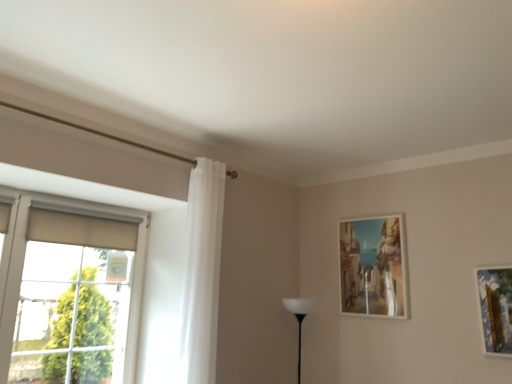
You are a GUI agent. You are given a task and a screenshot of the screen. Output one action in this format:
    pyautogui.click(x=<x>, y=<y>)
    Task: Click on the matte wooden picture frame at upper right
    Image resolution: width=512 pixels, height=384 pixels.
    Given the screenshot: What is the action you would take?
    (373, 267)

This screenshot has width=512, height=384. What do you see at coordinates (298, 319) in the screenshot?
I see `white matte table lamp at center` at bounding box center [298, 319].

The image size is (512, 384). What do you see at coordinates (202, 271) in the screenshot?
I see `white sheer curtain at left` at bounding box center [202, 271].

Identify the location of matte wooden picture frame at upper right. (373, 267).

Between white matte table lamp at center and matte wooden picture frame at upper right, which one appears on the left side from the viewer's perspective?

white matte table lamp at center is more to the left.

What's the angular difference between white matte table lamp at center and matte wooden picture frame at upper right's facing directions?

0.0042 degrees separate the facing orientations of white matte table lamp at center and matte wooden picture frame at upper right.

From a real-world perspective, is white matte table lamp at center on top of matte wooden picture frame at upper right?

Incorrect, from a real-world perspective, white matte table lamp at center is lower than matte wooden picture frame at upper right.

Can you confirm if white matte table lamp at center is shorter than matte wooden picture frame at upper right?

Yes, white matte table lamp at center is shorter than matte wooden picture frame at upper right.

Is white sheer curtain at left thinner than matte beige roller blind at left?

Incorrect, the width of white sheer curtain at left is not less than that of matte beige roller blind at left.

At what (x,y) coordinates should I click in order to perform the action: click on curtain on the right of matte beige roller blind at left. Please return your answer as a coordinate pair (x, y). This screenshot has height=384, width=512. Looking at the image, I should click on (202, 271).

From the image's perspective, is white sheer curtain at left below matte beige roller blind at left?

No, from the image's perspective, white sheer curtain at left is not beneath matte beige roller blind at left.

Considering the positions of point (213, 344) and point (7, 327), is point (213, 344) closer or farther from the camera than point (7, 327)?

Point (213, 344) is positioned farther from the camera compared to point (7, 327).

Does white sheer curtain at left have a greater width compared to white matte table lamp at center?

Yes.

Looking at this image, considering the relative sizes of white sheer curtain at left and white matte table lamp at center in the image provided, is white sheer curtain at left shorter than white matte table lamp at center?

In fact, white sheer curtain at left may be taller than white matte table lamp at center.

Based on the photo, is white sheer curtain at left smaller than white matte table lamp at center?

No, white sheer curtain at left is not smaller than white matte table lamp at center.

Visually, is white sheer curtain at left positioned to the left or to the right of white matte table lamp at center?

Clearly, white sheer curtain at left is on the left of white matte table lamp at center in the image.

Do you think matte beige roller blind at left is within white sheer curtain at left, or outside of it?

The correct answer is: outside.

Is matte beige roller blind at left to the right of white sheer curtain at left from the viewer's perspective?

No, matte beige roller blind at left is not to the right of white sheer curtain at left.

From the image's perspective, would you say matte beige roller blind at left is shown under white sheer curtain at left?

Yes.

Is matte beige roller blind at left thinner than white sheer curtain at left?

Correct, the width of matte beige roller blind at left is less than that of white sheer curtain at left.

Is matte wooden picture frame at upper right far away from white sheer curtain at left?

Yes, matte wooden picture frame at upper right and white sheer curtain at left are quite far apart.

Looking at this image, from a real-world perspective, is matte wooden picture frame at upper right located beneath white sheer curtain at left?

No, from a real-world perspective, matte wooden picture frame at upper right is not below white sheer curtain at left.

In terms of height, does matte wooden picture frame at upper right look taller or shorter compared to white sheer curtain at left?

Clearly, matte wooden picture frame at upper right is shorter compared to white sheer curtain at left.

Is matte wooden picture frame at upper right facing towards white sheer curtain at left?

Yes, matte wooden picture frame at upper right is facing white sheer curtain at left.

Between matte beige roller blind at left and white matte table lamp at center, which one has smaller width?

matte beige roller blind at left is thinner.

Is point (191, 303) less distant than point (298, 331)?

Yes.

Is white matte table lamp at center completely or partially inside matte beige roller blind at left?

No, matte beige roller blind at left does not contain white matte table lamp at center.

Consider the image. Is matte beige roller blind at left positioned far away from white matte table lamp at center?

Yes, matte beige roller blind at left and white matte table lamp at center are located far from each other.

Which is more to the right, white sheer curtain at left or matte wooden picture frame at upper right?

Positioned to the right is matte wooden picture frame at upper right.

Considering the sizes of objects white sheer curtain at left and matte wooden picture frame at upper right in the image provided, who is bigger, white sheer curtain at left or matte wooden picture frame at upper right?

white sheer curtain at left is bigger.

Is white sheer curtain at left in contact with matte wooden picture frame at upper right?

No, white sheer curtain at left is not beside matte wooden picture frame at upper right.

How many degrees apart are the facing directions of white sheer curtain at left and matte wooden picture frame at upper right?

90 degrees.

Where is `picture frame above the white matte table lamp at center (from a real-world perspective)`? The image size is (512, 384). picture frame above the white matte table lamp at center (from a real-world perspective) is located at coordinates (373, 267).

Identify the location of window on the left side of white sheer curtain at left. This screenshot has height=384, width=512. (70, 287).

When comparing their distances from white sheer curtain at left, does matte beige roller blind at left or matte wooden picture frame at upper right seem closer?

Among the two, matte beige roller blind at left is located nearer to white sheer curtain at left.

Considering their positions, is white sheer curtain at left positioned further to white matte table lamp at center than matte wooden picture frame at upper right?

white sheer curtain at left lies further to white matte table lamp at center than the other object.

Based on their spatial positions, is white sheer curtain at left or white matte table lamp at center closer to matte wooden picture frame at upper right?

Based on the image, white matte table lamp at center appears to be nearer to matte wooden picture frame at upper right.

Based on their spatial positions, is matte wooden picture frame at upper right or white sheer curtain at left closer to white matte table lamp at center?

The object closer to white matte table lamp at center is matte wooden picture frame at upper right.

Considering their positions, is white matte table lamp at center positioned closer to white sheer curtain at left than matte wooden picture frame at upper right?

white matte table lamp at center is positioned closer to the anchor white sheer curtain at left.

Considering their positions, is white matte table lamp at center positioned further to matte beige roller blind at left than white sheer curtain at left?

white matte table lamp at center lies further to matte beige roller blind at left than the other object.

Consider the image. Considering their positions, is matte beige roller blind at left positioned closer to white sheer curtain at left than white matte table lamp at center?

The object closer to white sheer curtain at left is matte beige roller blind at left.

When comparing their distances from white matte table lamp at center, does matte beige roller blind at left or matte wooden picture frame at upper right seem further?

Among the two, matte beige roller blind at left is located further to white matte table lamp at center.

The width and height of the screenshot is (512, 384). Identify the location of table lamp between white sheer curtain at left and matte wooden picture frame at upper right. (298, 319).

Locate an element on the screen. The width and height of the screenshot is (512, 384). table lamp situated between matte beige roller blind at left and matte wooden picture frame at upper right from left to right is located at coordinates (298, 319).

Identify the location of curtain located between matte beige roller blind at left and matte wooden picture frame at upper right in the left-right direction. The height and width of the screenshot is (384, 512). (202, 271).

The image size is (512, 384). In order to click on curtain between matte beige roller blind at left and white matte table lamp at center in the horizontal direction in this screenshot , I will do `click(202, 271)`.